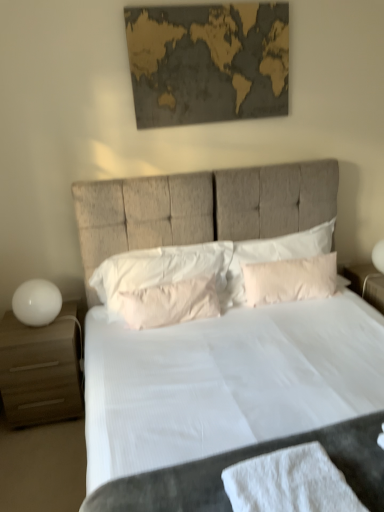
Question: Would you say matte wood nightstand at left is to the left or to the right of white glossy table lamp at left in the picture?

Choices:
 (A) right
 (B) left

Answer: (B)

Question: Is matte wood nightstand at left wider or thinner than white glossy table lamp at left?

Choices:
 (A) thin
 (B) wide

Answer: (B)

Question: Which is farther from the gold textured map at upper center?

Choices:
 (A) white fabric bed at center
 (B) pink fabric pillow at center, acting as the third pillow starting from the left
 (C) matte wood nightstand at left
 (D) pink fabric pillow at center, which appears as the second pillow when viewed from the right
 (E) white glossy table lamp at left

Answer: (C)

Question: Which object is the closest to the white soft pillow at center, positioned as the first pillow in left-to-right order?

Choices:
 (A) white fabric bed at center
 (B) gold textured map at upper center
 (C) pink fabric pillow at center, arranged as the first pillow when viewed from the right
 (D) matte wood nightstand at left
 (E) white cotton bath towel at lower center

Answer: (A)